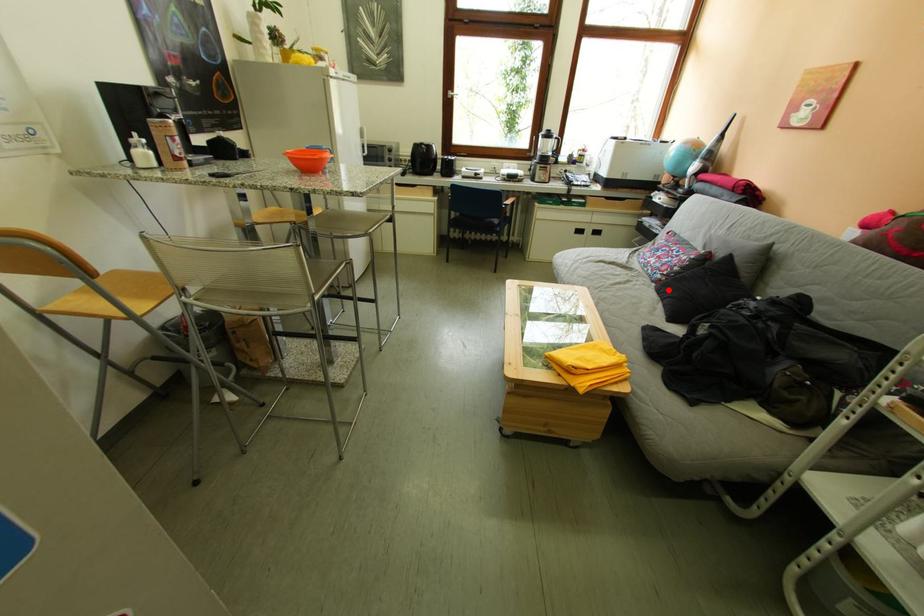
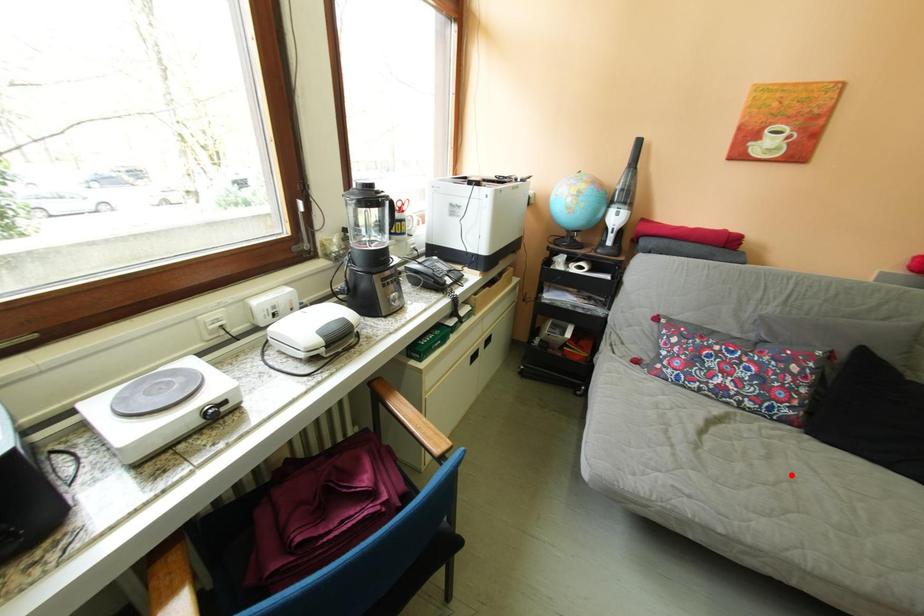
I am providing you with two images of the same scene from different viewpoints. A red point is marked on the first image and another point is marked on the second image. Are the points marked in image1 and image2 representing the same 3D position?

No